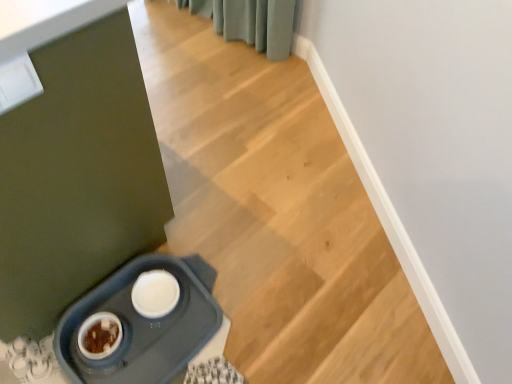
Question: Should I look upward or downward to see wooden stairs at center?

Choices:
 (A) down
 (B) up

Answer: (B)

Question: Would you consider wooden stairs at center to be distant from matte plastic pet feeder at lower left?

Choices:
 (A) yes
 (B) no

Answer: (B)

Question: Considering the relative sizes of wooden stairs at center and matte plastic pet feeder at lower left in the image provided, is wooden stairs at center wider than matte plastic pet feeder at lower left?

Choices:
 (A) yes
 (B) no

Answer: (A)

Question: Is wooden stairs at center thinner than matte plastic pet feeder at lower left?

Choices:
 (A) no
 (B) yes

Answer: (A)

Question: From the image's perspective, is wooden stairs at center above matte plastic pet feeder at lower left?

Choices:
 (A) yes
 (B) no

Answer: (A)

Question: Is the surface of wooden stairs at center in direct contact with matte plastic pet feeder at lower left?

Choices:
 (A) no
 (B) yes

Answer: (A)

Question: Can you confirm if wooden stairs at center is taller than matte plastic pet feeder at lower left?

Choices:
 (A) yes
 (B) no

Answer: (B)

Question: Is matte plastic pet feeder at lower left oriented away from wooden stairs at center?

Choices:
 (A) yes
 (B) no

Answer: (B)

Question: Considering the relative sizes of matte plastic pet feeder at lower left and wooden stairs at center in the image provided, is matte plastic pet feeder at lower left wider than wooden stairs at center?

Choices:
 (A) yes
 (B) no

Answer: (B)

Question: Is matte plastic pet feeder at lower left facing towards wooden stairs at center?

Choices:
 (A) yes
 (B) no

Answer: (B)

Question: Does matte plastic pet feeder at lower left appear on the left side of wooden stairs at center?

Choices:
 (A) no
 (B) yes

Answer: (A)

Question: Does matte plastic pet feeder at lower left have a lesser height compared to wooden stairs at center?

Choices:
 (A) yes
 (B) no

Answer: (B)

Question: Is matte plastic pet feeder at lower left behind wooden stairs at center?

Choices:
 (A) yes
 (B) no

Answer: (A)

Question: Looking at their shapes, would you say wooden stairs at center is wider or thinner than matte plastic pet feeder at lower left?

Choices:
 (A) thin
 (B) wide

Answer: (B)